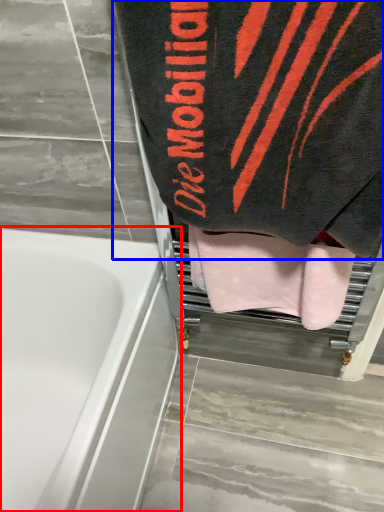
Question: Which point is closer to the camera, bathtub (highlighted by a red box) or towel (highlighted by a blue box)?

Choices:
 (A) bathtub
 (B) towel

Answer: (B)